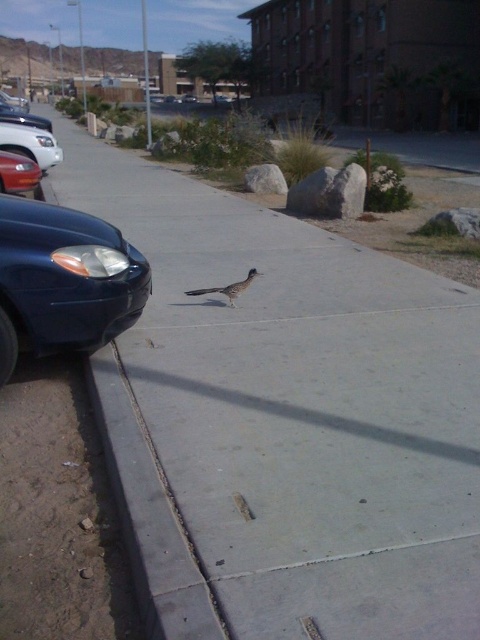
You are standing on the sidewalk and see the point marked at coordinates (63,280). What object is located at that point?

The glossy blue sedan at left is located at point (63,280).